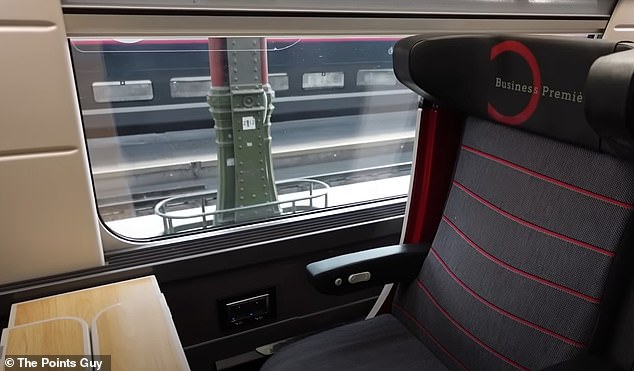
In order to click on head rest in this screenshot , I will do `click(553, 56)`.